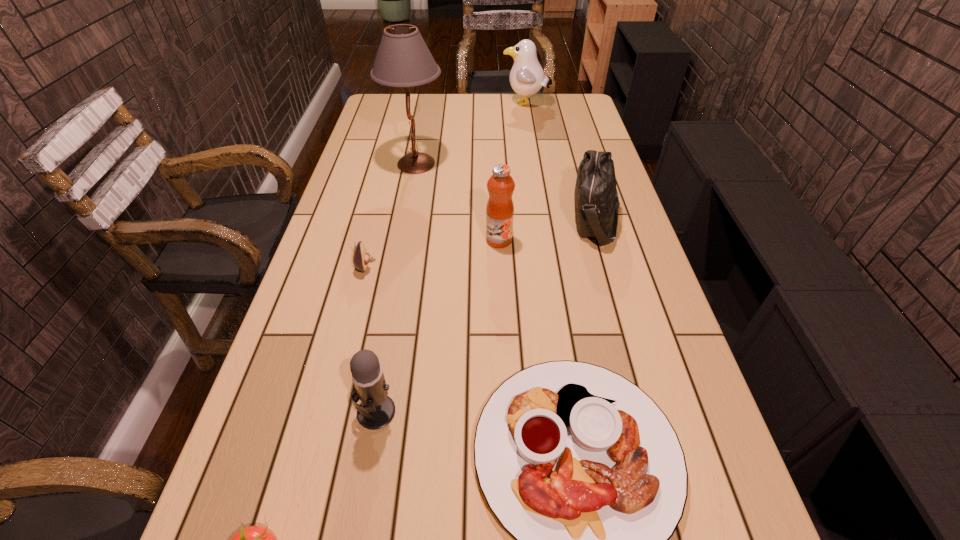
Identify the location of the second farthest object. (403, 59).

What are the coordinates of `the tallest object` in the screenshot? It's located at (x=403, y=59).

This screenshot has width=960, height=540. In order to click on the farthest object in this screenshot , I will do `click(527, 77)`.

The image size is (960, 540). I want to click on fruit juice, so click(x=500, y=209).

This screenshot has height=540, width=960. I want to click on shoulder bag, so click(x=596, y=199).

Locate an element on the screen. microphone is located at coordinates (376, 410).

Find the location of a particular element. the sixth tallest object is located at coordinates (361, 258).

Where is `the fifth farthest object`? The width and height of the screenshot is (960, 540). the fifth farthest object is located at coordinates [361, 258].

The image size is (960, 540). Find the location of `vacant space located 0.380m on the front-facing side of the table lamp`. vacant space located 0.380m on the front-facing side of the table lamp is located at coordinates (554, 164).

This screenshot has width=960, height=540. In order to click on vacant space located 0.320m on the beak of the gull in this screenshot , I will do `click(426, 105)`.